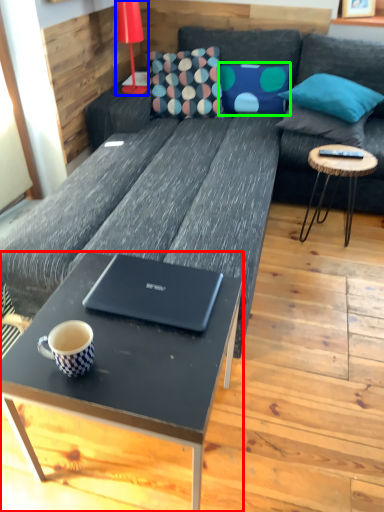
Question: Which object is positioned farthest from coffee table (highlighted by a red box)? Select from lamp (highlighted by a blue box) and pillow (highlighted by a green box).

Choices:
 (A) lamp
 (B) pillow

Answer: (B)